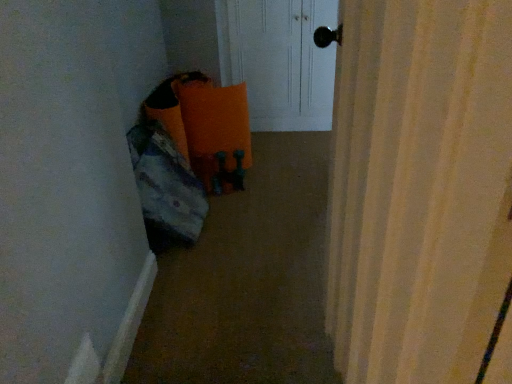
Question: Does point (259, 13) appear closer or farther from the camera than point (302, 221)?

Choices:
 (A) farther
 (B) closer

Answer: (A)

Question: Would you say white glossy door at upper center is to the left or to the right of carpeted floor at lower left in the picture?

Choices:
 (A) right
 (B) left

Answer: (A)

Question: Would you say white glossy door at upper center is inside or outside carpeted floor at lower left?

Choices:
 (A) inside
 (B) outside

Answer: (B)

Question: Looking at the image, does carpeted floor at lower left seem bigger or smaller compared to white glossy door at upper center?

Choices:
 (A) small
 (B) big

Answer: (A)

Question: From a real-world perspective, is carpeted floor at lower left physically located above or below white glossy door at upper center?

Choices:
 (A) above
 (B) below

Answer: (B)

Question: Is carpeted floor at lower left taller or shorter than white glossy door at upper center?

Choices:
 (A) tall
 (B) short

Answer: (B)

Question: Relative to white glossy door at upper center, is carpeted floor at lower left in front or behind?

Choices:
 (A) front
 (B) behind

Answer: (A)